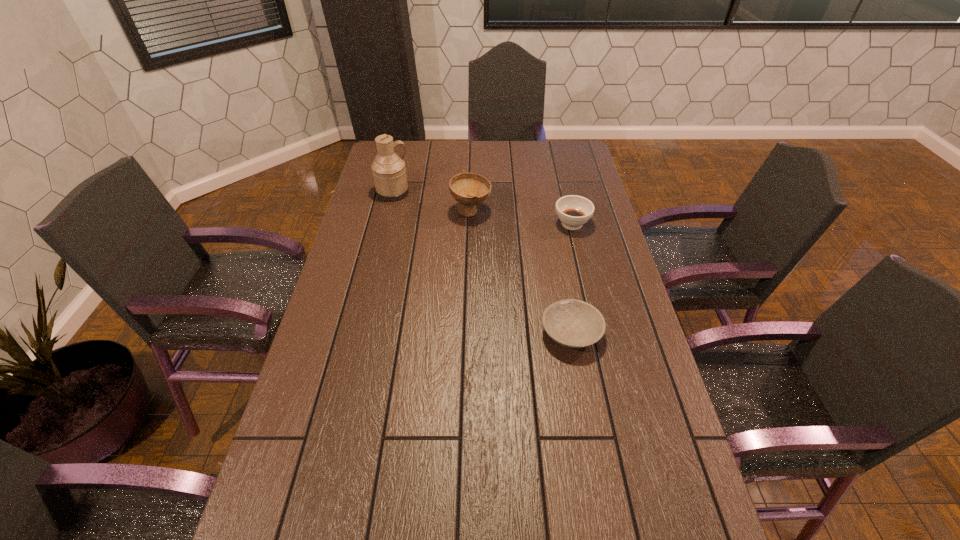
Find the location of a particular element. This screenshot has height=540, width=960. empty space that is in between the right soup bowl and the nearest object is located at coordinates (571, 279).

Where is `free space between the leftmost object and the right soup bowl`? free space between the leftmost object and the right soup bowl is located at coordinates pos(483,208).

Locate an element on the screen. blank region between the nearest object and the third object from right to left is located at coordinates (521, 273).

You are a GUI agent. You are given a task and a screenshot of the screen. Output one action in this format:
    pyautogui.click(x=<x>, y=<y>)
    Task: Click on the empty space between the taller soup bowl and the bowl
    This screenshot has width=960, height=540.
    Given the screenshot: What is the action you would take?
    pyautogui.click(x=521, y=273)

Find the location of a particular element. free spot between the tallest object and the second tallest object is located at coordinates (432, 202).

Find the location of `unoccupied position between the taller soup bowl and the second shortest object`. unoccupied position between the taller soup bowl and the second shortest object is located at coordinates (521, 218).

Identify the location of free area in between the left soup bowl and the bowl. The width and height of the screenshot is (960, 540). (521, 273).

At what (x,y) coordinates should I click in order to perform the action: click on free space between the nearest object and the tallest object. Please return your answer as a coordinate pair (x, y). The width and height of the screenshot is (960, 540). Looking at the image, I should click on click(482, 263).

Find the location of a particular element. Image resolution: width=960 pixels, height=540 pixels. the closest object to the shortest object is located at coordinates (573, 211).

Identify the location of the closest object to the second shortest object. (469, 189).